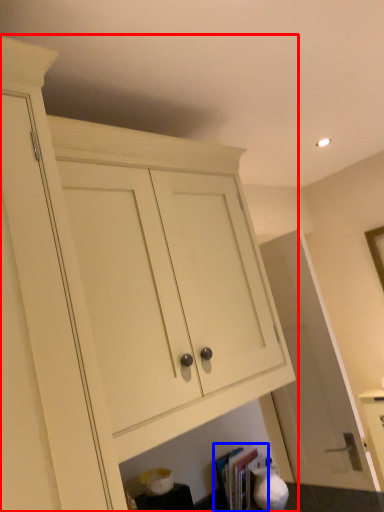
Question: Which point is closer to the camera, cabinetry (highlighted by a red box) or book (highlighted by a blue box)?

Choices:
 (A) cabinetry
 (B) book

Answer: (A)